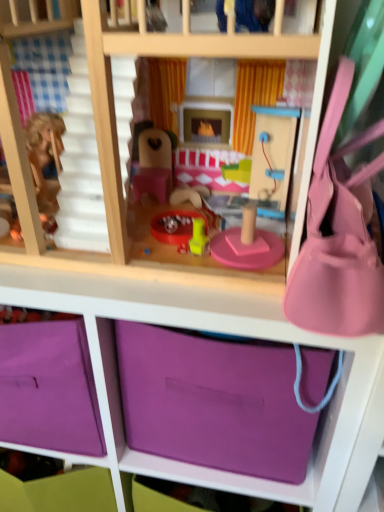
Question: Considering the relative positions of purple matte storage box at lower center and pink wood bunk bed at center in the image provided, is purple matte storage box at lower center to the left or to the right of pink wood bunk bed at center?

Choices:
 (A) left
 (B) right

Answer: (B)

Question: From the image's perspective, is purple matte storage box at lower center located above or below pink wood bunk bed at center?

Choices:
 (A) above
 (B) below

Answer: (B)

Question: Which object is positioned closest to the pink fabric purse at right?

Choices:
 (A) pink wood bunk bed at center
 (B) purple matte storage box at lower center
 (C) purple fabric storage at center

Answer: (A)

Question: Which object is positioned farthest from the purple fabric storage at center?

Choices:
 (A) purple matte storage box at lower center
 (B) pink fabric purse at right
 (C) pink wood bunk bed at center

Answer: (C)